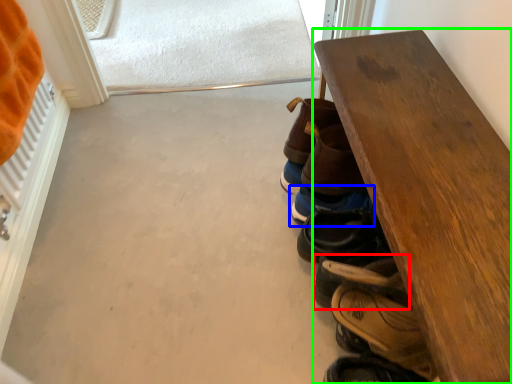
Question: Which object is the closest to the footwear (highlighted by a red box)? Choose among these: footwear (highlighted by a blue box) or table (highlighted by a green box).

Choices:
 (A) footwear
 (B) table

Answer: (A)